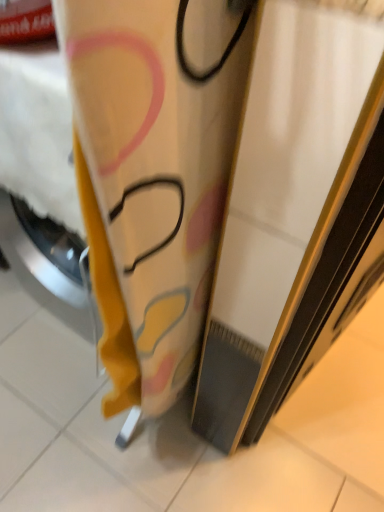
Measure the distance between point (x=100, y=151) and camera.

Point (x=100, y=151) is 13.86 inches away from camera.

Where is `yellow fabric surfboard at center`? Image resolution: width=384 pixels, height=512 pixels. yellow fabric surfboard at center is located at coordinates (156, 170).

Describe the element at coordinates (156, 170) in the screenshot. I see `yellow fabric surfboard at center` at that location.

Locate an element on the screen. This screenshot has height=512, width=384. yellow fabric surfboard at center is located at coordinates (156, 170).